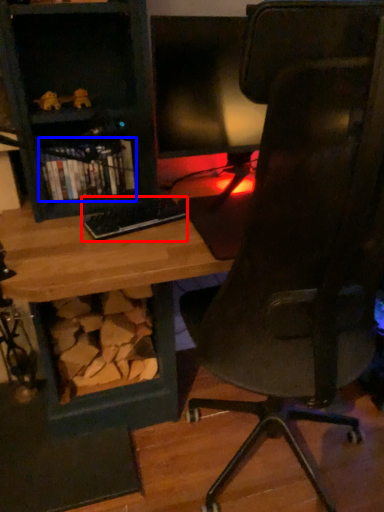
Question: Which object is closer to the camera taking this photo, keyboard (highlighted by a red box) or book (highlighted by a blue box)?

Choices:
 (A) keyboard
 (B) book

Answer: (A)